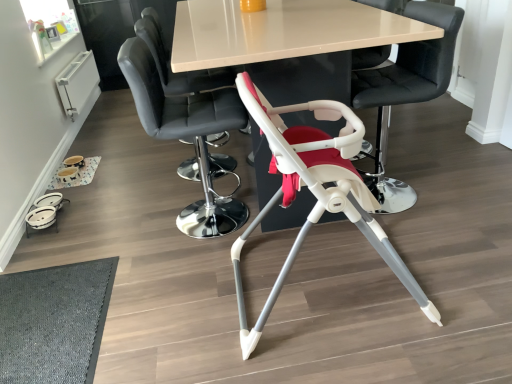
Where is `vacant space situated on the left part of smooth black chair at center, which is the 3th chair in right-to-left order`? The width and height of the screenshot is (512, 384). vacant space situated on the left part of smooth black chair at center, which is the 3th chair in right-to-left order is located at coordinates (134, 225).